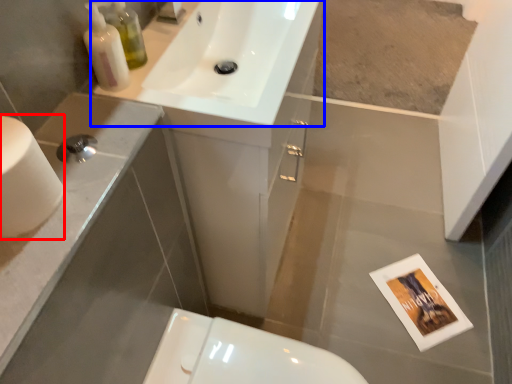
Question: Which object is further to the camera taking this photo, toilet paper (highlighted by a red box) or sink (highlighted by a blue box)?

Choices:
 (A) toilet paper
 (B) sink

Answer: (B)